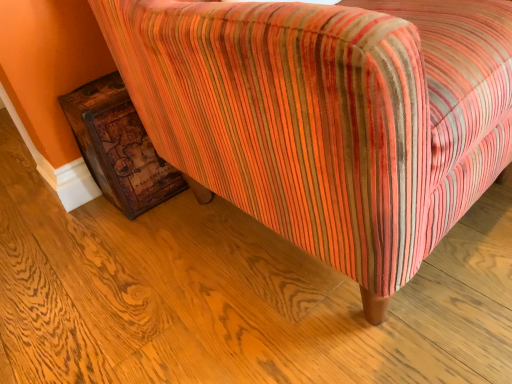
In order to face distressed wood trunk at lower left, should I rotate leftwards or rightwards?

Turn left approximately 18.908 degrees to face it.

This screenshot has height=384, width=512. Find the location of `distressed wood trunk at lower left`. distressed wood trunk at lower left is located at coordinates (120, 147).

What do you see at coordinates (120, 147) in the screenshot? This screenshot has height=384, width=512. I see `distressed wood trunk at lower left` at bounding box center [120, 147].

What do you see at coordinates (322, 118) in the screenshot? Image resolution: width=512 pixels, height=384 pixels. I see `striped fabric chair at lower right` at bounding box center [322, 118].

You are a GUI agent. You are given a task and a screenshot of the screen. Output one action in this format:
    pyautogui.click(x=<x>, y=<y>)
    Task: Click on the striped fabric chair at lower right
    The height and width of the screenshot is (384, 512).
    Given the screenshot: What is the action you would take?
    pyautogui.click(x=322, y=118)

Image resolution: width=512 pixels, height=384 pixels. Identify the location of distressed wood trunk at lower left. (120, 147).

Between striped fabric chair at lower right and distressed wood trunk at lower left, which one appears on the right side from the viewer's perspective?

striped fabric chair at lower right is more to the right.

In the image, is striped fabric chair at lower right positioned in front of or behind distressed wood trunk at lower left?

In the image, striped fabric chair at lower right appears in front of distressed wood trunk at lower left.

Is point (362, 194) behind point (79, 131)?

No.

From the image's perspective, who appears lower, striped fabric chair at lower right or distressed wood trunk at lower left?

From the image's view, distressed wood trunk at lower left is below.

From a real-world perspective, is striped fabric chair at lower right below distressed wood trunk at lower left?

No, from a real-world perspective, striped fabric chair at lower right is not under distressed wood trunk at lower left.

Does striped fabric chair at lower right have a greater width compared to distressed wood trunk at lower left?

Correct, the width of striped fabric chair at lower right exceeds that of distressed wood trunk at lower left.

Considering the sizes of striped fabric chair at lower right and distressed wood trunk at lower left in the image, is striped fabric chair at lower right taller or shorter than distressed wood trunk at lower left?

striped fabric chair at lower right is taller than distressed wood trunk at lower left.

Considering the sizes of objects striped fabric chair at lower right and distressed wood trunk at lower left in the image provided, who is smaller, striped fabric chair at lower right or distressed wood trunk at lower left?

Smaller between the two is distressed wood trunk at lower left.

Would you say distressed wood trunk at lower left is part of striped fabric chair at lower right's contents?

Yes, distressed wood trunk at lower left is a part of striped fabric chair at lower right.

Is striped fabric chair at lower right beside distressed wood trunk at lower left?

They are not placed beside each other.

Does striped fabric chair at lower right turn towards distressed wood trunk at lower left?

No, striped fabric chair at lower right is not turned towards distressed wood trunk at lower left.

Where is `chair positioned vertically above the distressed wood trunk at lower left (from a real-world perspective)`? This screenshot has height=384, width=512. chair positioned vertically above the distressed wood trunk at lower left (from a real-world perspective) is located at coordinates pos(322,118).

Considering the relative positions of distressed wood trunk at lower left and striped fabric chair at lower right in the image provided, is distressed wood trunk at lower left to the right of striped fabric chair at lower right from the viewer's perspective?

In fact, distressed wood trunk at lower left is to the left of striped fabric chair at lower right.

Which object is more forward, distressed wood trunk at lower left or striped fabric chair at lower right?

striped fabric chair at lower right is more forward.

Does point (110, 127) lie in front of point (332, 101)?

No, it is not.

From the image's perspective, does distressed wood trunk at lower left appear lower than striped fabric chair at lower right?

Yes.

From a real-world perspective, who is located higher, distressed wood trunk at lower left or striped fabric chair at lower right?

striped fabric chair at lower right.

Between distressed wood trunk at lower left and striped fabric chair at lower right, which one has larger width?

Wider between the two is striped fabric chair at lower right.

Between distressed wood trunk at lower left and striped fabric chair at lower right, which one has less height?

Standing shorter between the two is distressed wood trunk at lower left.

Who is smaller, distressed wood trunk at lower left or striped fabric chair at lower right?

distressed wood trunk at lower left.

Is distressed wood trunk at lower left not inside striped fabric chair at lower right?

No, distressed wood trunk at lower left is not entirely external to striped fabric chair at lower right.

Is distressed wood trunk at lower left directly adjacent to striped fabric chair at lower right?

No, distressed wood trunk at lower left is not touching striped fabric chair at lower right.

Is distressed wood trunk at lower left looking in the opposite direction of striped fabric chair at lower right?

Yes, striped fabric chair at lower right is at the back of distressed wood trunk at lower left.

Can you tell me how much distressed wood trunk at lower left and striped fabric chair at lower right differ in facing direction?

The angular difference between distressed wood trunk at lower left and striped fabric chair at lower right is 3.9 degrees.

How distant is distressed wood trunk at lower left from striped fabric chair at lower right?

They are 17.05 inches apart.

The height and width of the screenshot is (384, 512). I want to click on chair lying in front of the distressed wood trunk at lower left, so click(322, 118).

Find the location of a particular element. The width and height of the screenshot is (512, 384). furniture below the striped fabric chair at lower right (from the image's perspective) is located at coordinates (120, 147).

You are a GUI agent. You are given a task and a screenshot of the screen. Output one action in this format:
    pyautogui.click(x=<x>, y=<y>)
    Task: Click on the furniture lying on the left of striped fabric chair at lower right
    The height and width of the screenshot is (384, 512).
    Given the screenshot: What is the action you would take?
    pyautogui.click(x=120, y=147)